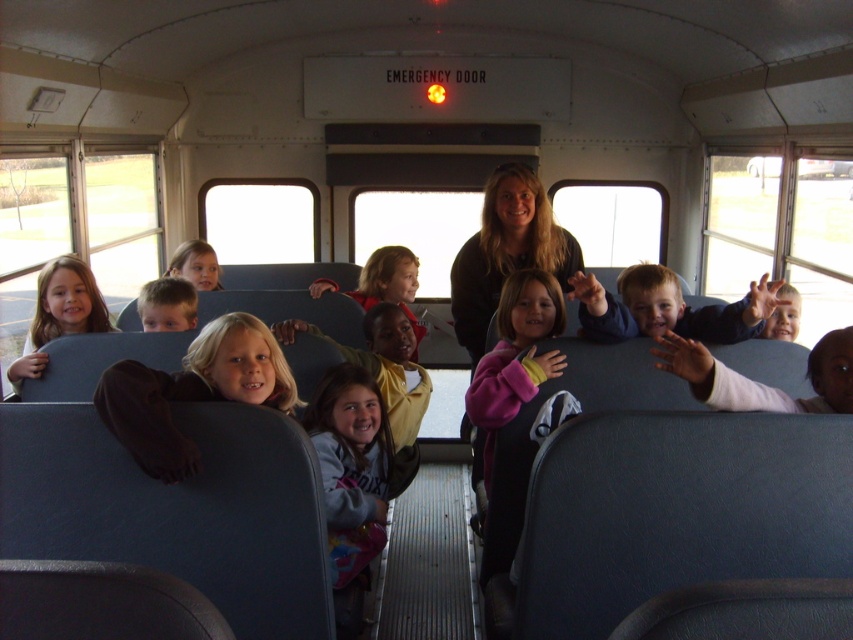
You are a photographer taking a picture of the school bus interior. You notice the smooth blue jacket at right and the matte yellow jacket at center. Which jacket appears shorter in the photo?

The smooth blue jacket at right appears shorter than the matte yellow jacket at center in the photo.

You are a photographer taking a picture of the school bus interior. You notice a point at coordinate (506, 252) that corresponds to a smooth black shirt at center. Is this point located in the center of the image?

Yes, the smooth black shirt at center is represented by point (506, 252), so the point is located in the center of the image.

You are standing inside the school bus and looking towards the back. There are two points marked on the floor, point [535,264] and point [726,305]. Which point is closer to you?

Point [535,264] is closer to you because it is further to the viewer than point [726,305].